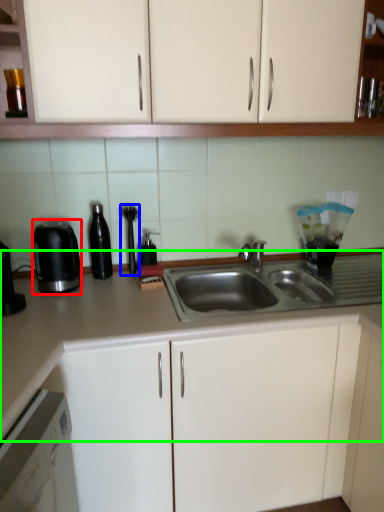
Question: Which object is the closest to the kitchen appliance (highlighted by a red box)? Choose among these: appliance (highlighted by a blue box) or countertop (highlighted by a green box).

Choices:
 (A) appliance
 (B) countertop

Answer: (B)